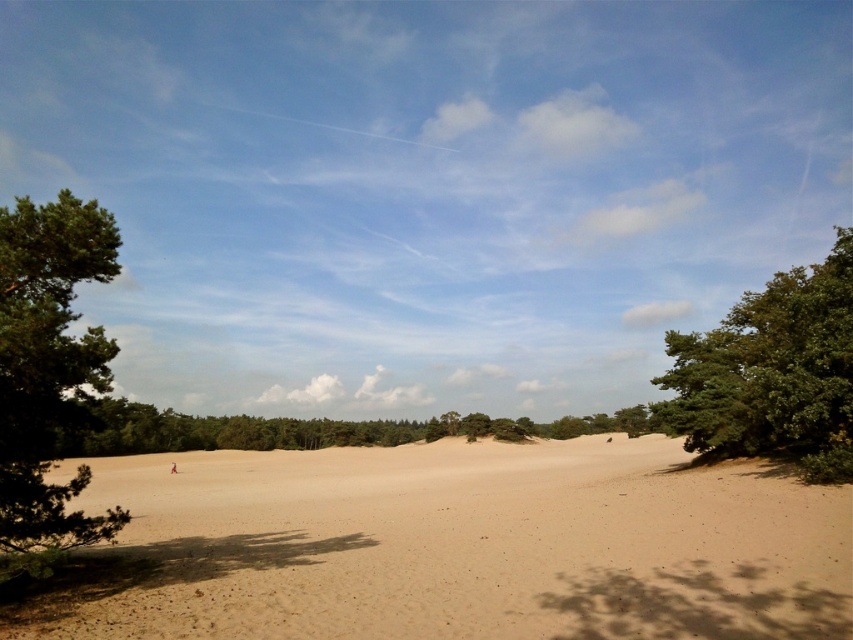
Question: Which object appears farthest from the camera in this image?

Choices:
 (A) green leafy tree at center
 (B) green leafy tree at right
 (C) beige sandy dunes at center

Answer: (B)

Question: Considering the real-world distances, which object is closest to the green textured tree at left?

Choices:
 (A) green leafy tree at center
 (B) beige sandy dunes at center

Answer: (B)

Question: Can you confirm if green leafy tree at right is wider than green leafy tree at center?

Choices:
 (A) no
 (B) yes

Answer: (B)

Question: Considering the relative positions of green textured tree at left and green leafy tree at right in the image provided, where is green textured tree at left located with respect to green leafy tree at right?

Choices:
 (A) below
 (B) above

Answer: (A)

Question: Which object appears closest to the camera in this image?

Choices:
 (A) green leafy tree at center
 (B) green textured tree at left
 (C) green leafy tree at right

Answer: (B)

Question: Does beige sandy dunes at center appear under green leafy tree at right?

Choices:
 (A) no
 (B) yes

Answer: (B)